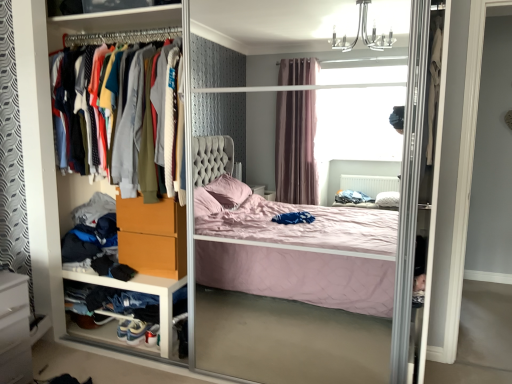
Question: Should I look upward or downward to see knit sweater at left?

Choices:
 (A) up
 (B) down

Answer: (A)

Question: Considering the relative sizes of matte orange drawer at lower left and white plastic drawer at lower left in the image provided, is matte orange drawer at lower left shorter than white plastic drawer at lower left?

Choices:
 (A) no
 (B) yes

Answer: (A)

Question: Is matte orange drawer at lower left beside white plastic drawer at lower left?

Choices:
 (A) no
 (B) yes

Answer: (A)

Question: Is matte orange drawer at lower left at the left side of white plastic drawer at lower left?

Choices:
 (A) no
 (B) yes

Answer: (A)

Question: Is matte orange drawer at lower left aimed at white plastic drawer at lower left?

Choices:
 (A) yes
 (B) no

Answer: (B)

Question: Is matte orange drawer at lower left positioned far away from white plastic drawer at lower left?

Choices:
 (A) no
 (B) yes

Answer: (A)

Question: Is matte orange drawer at lower left smaller than white plastic drawer at lower left?

Choices:
 (A) no
 (B) yes

Answer: (B)

Question: Is white suede sneaker at lower left, which appears as the 2th shoe when viewed from the right, oriented towards white leather shoe at lower left, which ranks as the 1th shoe in right-to-left order?

Choices:
 (A) yes
 (B) no

Answer: (B)

Question: Considering the relative sizes of white suede sneaker at lower left, placed as the 1th shoe when sorted from left to right, and white leather shoe at lower left, which ranks as the 1th shoe in right-to-left order, in the image provided, is white suede sneaker at lower left, placed as the 1th shoe when sorted from left to right, taller than white leather shoe at lower left, which ranks as the 1th shoe in right-to-left order,?

Choices:
 (A) yes
 (B) no

Answer: (A)

Question: Does white suede sneaker at lower left, placed as the 1th shoe when sorted from left to right, have a lesser height compared to white leather shoe at lower left, acting as the 2th shoe starting from the left?

Choices:
 (A) yes
 (B) no

Answer: (B)

Question: From the image's perspective, is white suede sneaker at lower left, placed as the 1th shoe when sorted from left to right, on top of white leather shoe at lower left, which ranks as the 1th shoe in right-to-left order?

Choices:
 (A) no
 (B) yes

Answer: (B)

Question: From a real-world perspective, is white suede sneaker at lower left, placed as the 1th shoe when sorted from left to right, positioned under white leather shoe at lower left, acting as the 2th shoe starting from the left, based on gravity?

Choices:
 (A) yes
 (B) no

Answer: (A)

Question: Considering the relative sizes of white suede sneaker at lower left, placed as the 1th shoe when sorted from left to right, and white leather shoe at lower left, which ranks as the 1th shoe in right-to-left order, in the image provided, is white suede sneaker at lower left, placed as the 1th shoe when sorted from left to right, bigger than white leather shoe at lower left, which ranks as the 1th shoe in right-to-left order,?

Choices:
 (A) no
 (B) yes

Answer: (B)

Question: Is white plastic drawer at lower left positioned before white glossy vanity at lower left?

Choices:
 (A) no
 (B) yes

Answer: (A)